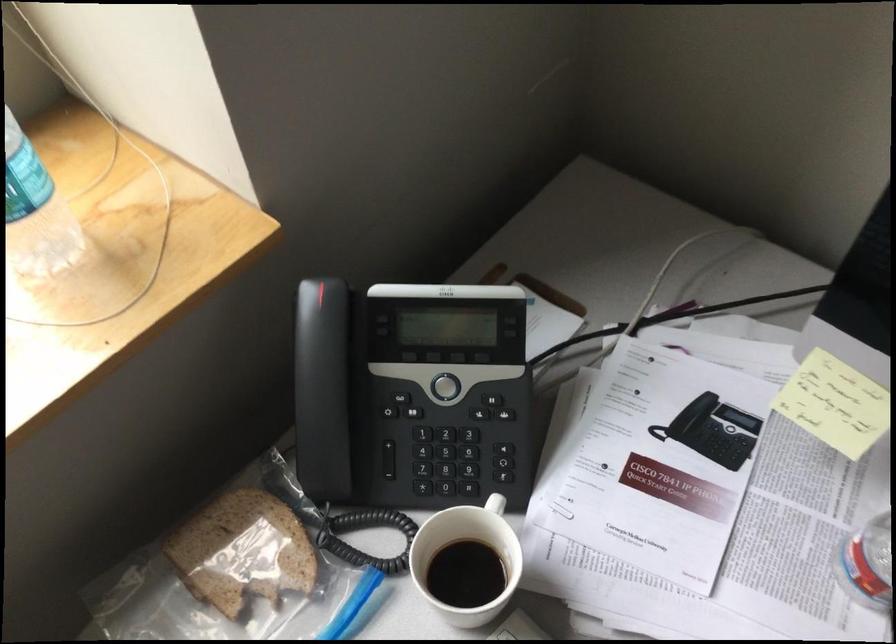
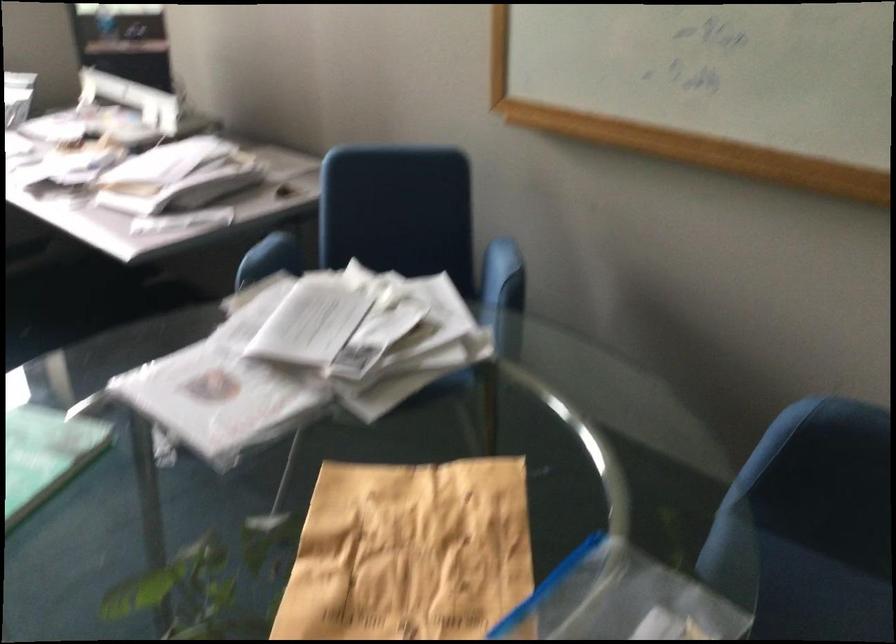
In a continuous first-person perspective shot, in which direction is the camera moving?

The cameraman moved toward right, backward.